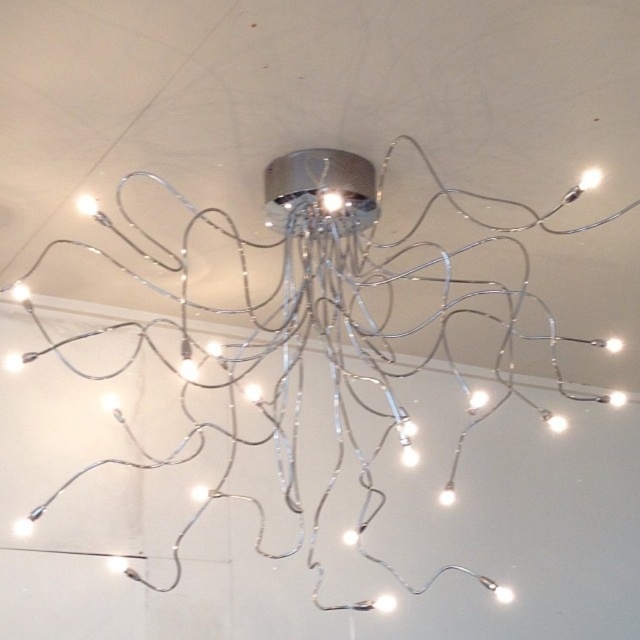
Question: Is white glossy light at center in front of white glossy light bulb at center?

Choices:
 (A) no
 (B) yes

Answer: (B)

Question: Among these points, which one is farthest from the camera?

Choices:
 (A) (509, 314)
 (B) (328, 205)
 (C) (621, 396)

Answer: (C)

Question: Is metallic wire chandelier at center to the right of white glossy light at upper right from the viewer's perspective?

Choices:
 (A) yes
 (B) no

Answer: (B)

Question: Which of the following is the closest to the observer?

Choices:
 (A) (97, 198)
 (B) (486, 396)

Answer: (A)

Question: Does metallic wire chandelier at center have a greater width compared to matte silver wire at upper left?

Choices:
 (A) yes
 (B) no

Answer: (A)

Question: Which point appears farthest from the camera in this image?

Choices:
 (A) (468, 401)
 (B) (88, 376)

Answer: (A)